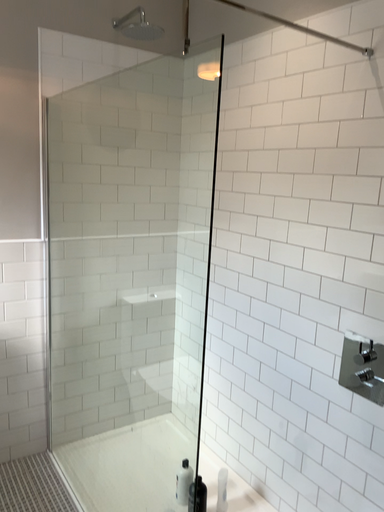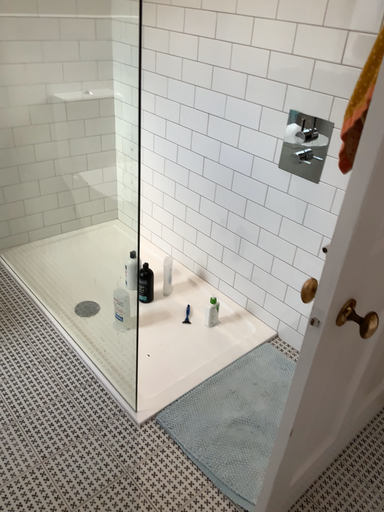
Question: Which way did the camera rotate in the video?

Choices:
 (A) rotated right
 (B) rotated left

Answer: (A)